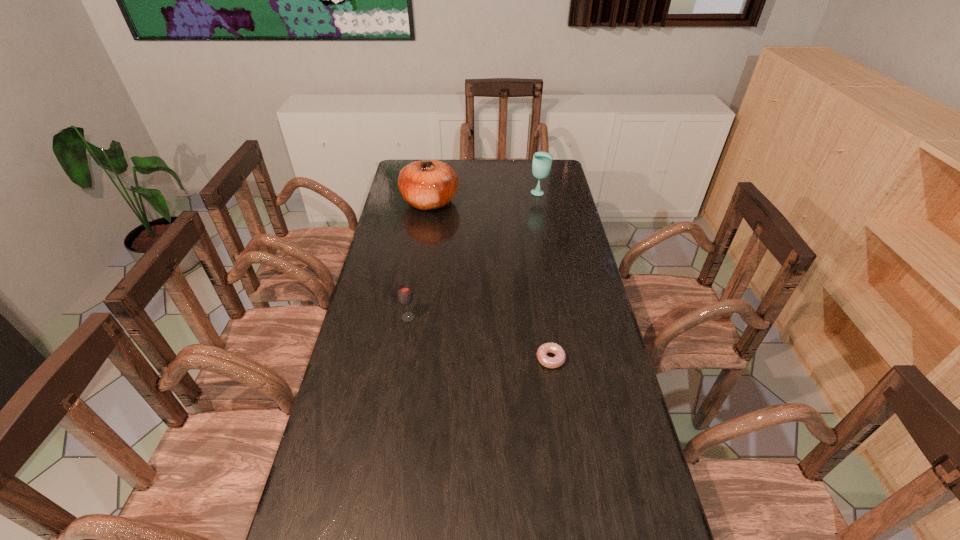
This screenshot has width=960, height=540. In order to click on pumpkin in this screenshot , I will do [x=430, y=184].

Identify the location of the farther glass drink container. The width and height of the screenshot is (960, 540). (542, 161).

At what (x,y) coordinates should I click in order to perform the action: click on the taller glass drink container. Please return your answer as a coordinate pair (x, y). The image size is (960, 540). Looking at the image, I should click on (542, 161).

Where is `the left glass drink container`? The height and width of the screenshot is (540, 960). the left glass drink container is located at coordinates (405, 297).

You are a GUI agent. You are given a task and a screenshot of the screen. Output one action in this format:
    pyautogui.click(x=<x>, y=<y>)
    Task: Click on the shorter glass drink container
    
    Given the screenshot: What is the action you would take?
    pyautogui.click(x=405, y=297)

This screenshot has height=540, width=960. I want to click on the shortest object, so click(x=550, y=362).

You are a GUI agent. You are given a task and a screenshot of the screen. Output one action in this format:
    pyautogui.click(x=<x>, y=<y>)
    Task: Click on the doughnut
    The image size is (960, 540).
    Given the screenshot: What is the action you would take?
    pyautogui.click(x=550, y=362)

What are the coordinates of `free space located on the front of the pumpkin` in the screenshot? It's located at (421, 255).

Locate an element on the screen. free space located on the back of the farther glass drink container is located at coordinates (537, 178).

Where is `vacant area situated 0.320m on the right of the second shortest object`? This screenshot has height=540, width=960. vacant area situated 0.320m on the right of the second shortest object is located at coordinates (517, 318).